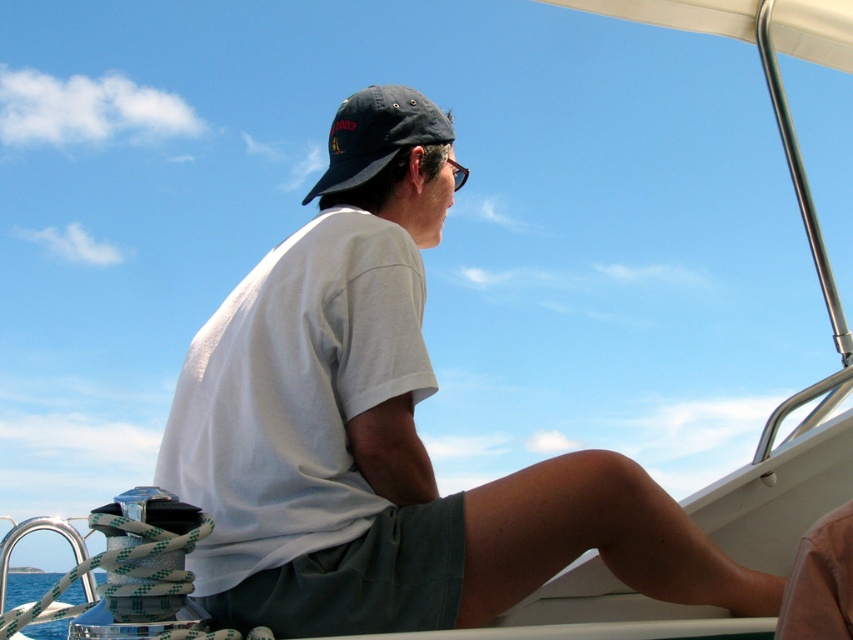
Can you confirm if white cotton shirt at center is positioned to the left of transparent plastic goggles at upper center?

Correct, you'll find white cotton shirt at center to the left of transparent plastic goggles at upper center.

Describe the element at coordinates (387, 433) in the screenshot. Image resolution: width=853 pixels, height=640 pixels. I see `white cotton shirt at center` at that location.

This screenshot has height=640, width=853. I want to click on white cotton shirt at center, so click(x=387, y=433).

Where is `white cotton shirt at center`? white cotton shirt at center is located at coordinates (387, 433).

Which is in front, point (311, 586) or point (395, 90)?

Point (311, 586)

Is the position of white cotton shirt at center more distant than that of dark blue fabric baseball cap at upper center?

No, white cotton shirt at center is in front of dark blue fabric baseball cap at upper center.

This screenshot has width=853, height=640. What do you see at coordinates (387, 433) in the screenshot?
I see `white cotton shirt at center` at bounding box center [387, 433].

Locate an element on the screen. This screenshot has height=640, width=853. white cotton shirt at center is located at coordinates (387, 433).

Who is positioned more to the right, white cotton shirt at center or dark gray cotton shorts at lower center?

white cotton shirt at center is more to the right.

Locate an element on the screen. The image size is (853, 640). white cotton shirt at center is located at coordinates (387, 433).

You are a GUI agent. You are given a task and a screenshot of the screen. Output one action in this format:
    pyautogui.click(x=<x>, y=<y>)
    Task: Click on the white cotton shirt at center
    
    Given the screenshot: What is the action you would take?
    pyautogui.click(x=387, y=433)